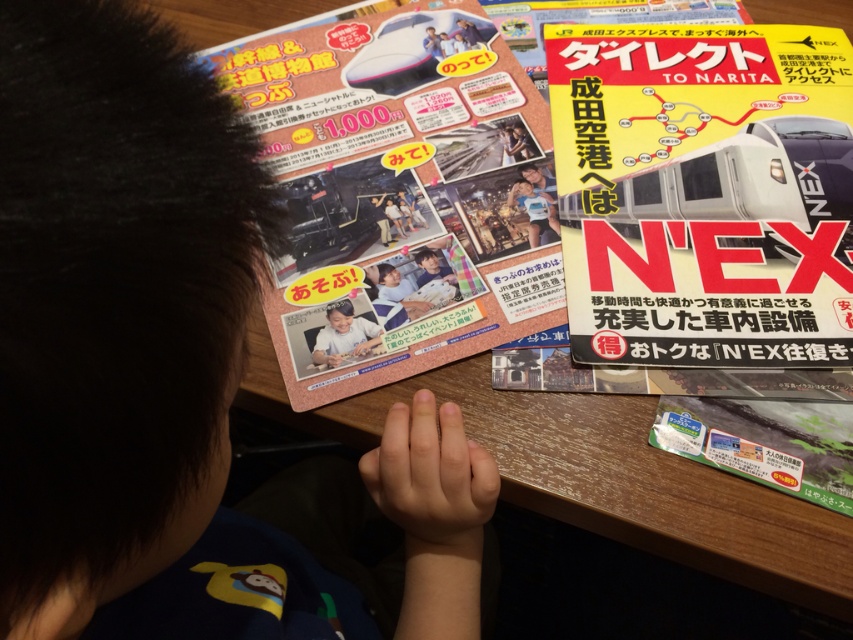
Question: Considering the real-world distances, which object is farthest from the dark brown hair at upper left?

Choices:
 (A) matte pink brochure at upper left
 (B) yellow paper magazine at upper right

Answer: (B)

Question: Is yellow paper magazine at upper right smaller than matte pink brochure at upper left?

Choices:
 (A) no
 (B) yes

Answer: (B)

Question: Is dark brown hair at upper left thinner than matte pink brochure at upper left?

Choices:
 (A) no
 (B) yes

Answer: (B)

Question: Among these objects, which one is farthest from the camera?

Choices:
 (A) yellow paper magazine at upper right
 (B) matte pink brochure at upper left
 (C) dark brown hair at upper left

Answer: (B)

Question: Is dark brown hair at upper left closer to camera compared to matte pink brochure at upper left?

Choices:
 (A) yes
 (B) no

Answer: (A)

Question: Which object is positioned farthest from the yellow paper magazine at upper right?

Choices:
 (A) dark brown hair at upper left
 (B) matte pink brochure at upper left

Answer: (A)